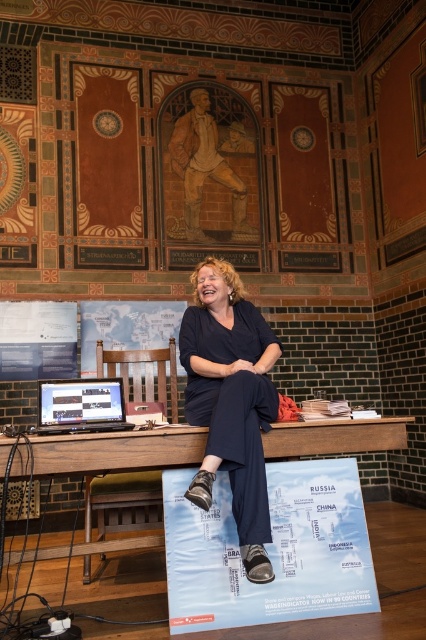
Does dark blue fabric pants at center have a larger size compared to matte black laptop at center?

Correct, dark blue fabric pants at center is larger in size than matte black laptop at center.

Which is more to the right, dark blue fabric pants at center or matte black laptop at center?

dark blue fabric pants at center is more to the right.

Is point (238, 474) less distant than point (100, 406)?

Yes, point (238, 474) is closer to viewer.

Where is `dark blue fabric pants at center`? dark blue fabric pants at center is located at coordinates (230, 401).

Can you confirm if dark blue fabric pants at center is thinner than wooden table at lower center?

Yes.

Image resolution: width=426 pixels, height=640 pixels. What do you see at coordinates (230, 401) in the screenshot? I see `dark blue fabric pants at center` at bounding box center [230, 401].

This screenshot has width=426, height=640. What are the coordinates of `dark blue fabric pants at center` in the screenshot? It's located at (230, 401).

Is point (299, 436) positioned after point (97, 387)?

No, (299, 436) is in front of (97, 387).

Is wooden table at lower center positioned in front of matte black laptop at center?

Yes.

Is point (143, 538) more distant than point (95, 413)?

Yes, it is.

Identify the location of wooden table at lower center. (118, 451).